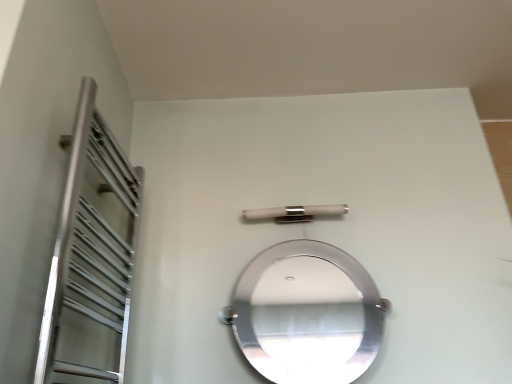
Question: From the image's perspective, is satin nickel bar at center on top of polished silver mirror at center?

Choices:
 (A) yes
 (B) no

Answer: (A)

Question: Does satin nickel bar at center have a smaller size compared to polished silver mirror at center?

Choices:
 (A) no
 (B) yes

Answer: (B)

Question: Is satin nickel bar at center facing away from polished silver mirror at center?

Choices:
 (A) no
 (B) yes

Answer: (A)

Question: Would you say polished silver mirror at center is part of satin nickel bar at center's contents?

Choices:
 (A) yes
 (B) no

Answer: (B)

Question: From a real-world perspective, is satin nickel bar at center positioned over polished silver mirror at center based on gravity?

Choices:
 (A) no
 (B) yes

Answer: (B)

Question: Does point (340, 299) appear closer or farther from the camera than point (264, 210)?

Choices:
 (A) closer
 (B) farther

Answer: (B)

Question: Looking at the image, does polished silver mirror at center seem bigger or smaller compared to satin nickel bar at center?

Choices:
 (A) small
 (B) big

Answer: (B)

Question: Considering the positions of polished silver mirror at center and satin nickel bar at center in the image, is polished silver mirror at center wider or thinner than satin nickel bar at center?

Choices:
 (A) wide
 (B) thin

Answer: (A)

Question: Relative to satin nickel bar at center, is polished silver mirror at center in front or behind?

Choices:
 (A) front
 (B) behind

Answer: (A)

Question: In terms of height, does polished silver mirror at center look taller or shorter compared to silver metallic towel rack at left?

Choices:
 (A) short
 (B) tall

Answer: (A)

Question: From the image's perspective, relative to silver metallic towel rack at left, is polished silver mirror at center above or below?

Choices:
 (A) above
 (B) below

Answer: (B)

Question: Would you say polished silver mirror at center is to the left or to the right of silver metallic towel rack at left in the picture?

Choices:
 (A) right
 (B) left

Answer: (A)

Question: Is point (294, 268) closer or farther from the camera than point (68, 256)?

Choices:
 (A) farther
 (B) closer

Answer: (A)

Question: Would you say silver metallic towel rack at left is to the left or to the right of polished silver mirror at center in the picture?

Choices:
 (A) left
 (B) right

Answer: (A)

Question: Which is correct: silver metallic towel rack at left is inside polished silver mirror at center, or outside of it?

Choices:
 (A) outside
 (B) inside

Answer: (A)